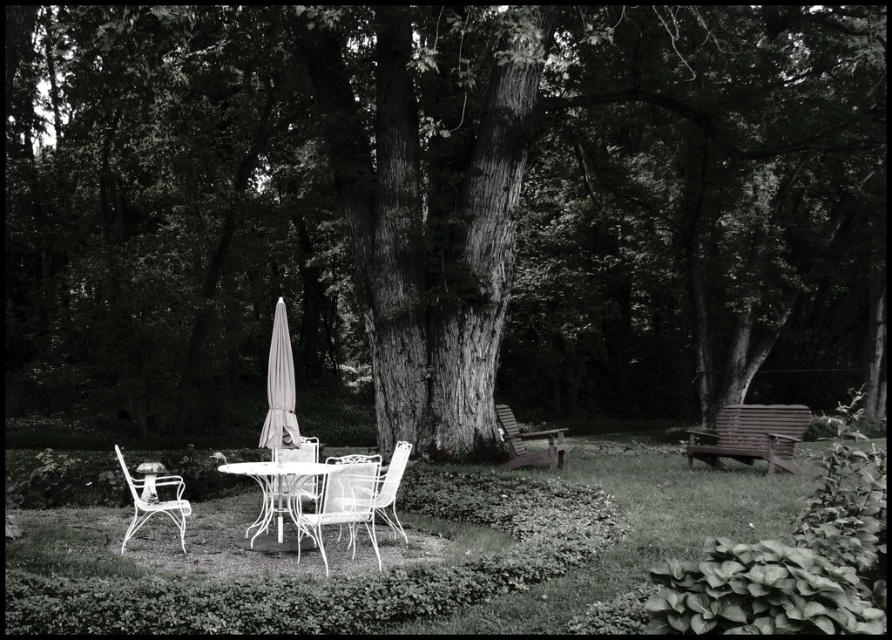
Question: In this image, where is white wrought iron table at center located relative to light gray fabric umbrella at center?

Choices:
 (A) above
 (B) below

Answer: (B)

Question: Can you confirm if light gray fabric umbrella at center is positioned above white metal chair at lower left?

Choices:
 (A) no
 (B) yes

Answer: (B)

Question: Among these objects, which one is nearest to the camera?

Choices:
 (A) white metal chair at lower left
 (B) white wrought iron table at center

Answer: (B)

Question: Is white wrought iron chair at center above white metal chair at center?

Choices:
 (A) yes
 (B) no

Answer: (B)

Question: Which point is closer to the camera?

Choices:
 (A) rough bark tree at center
 (B) white metal chair at center
 (C) light gray fabric umbrella at center

Answer: (B)

Question: Which is farther from the wooden slatted chair at center?

Choices:
 (A) light gray fabric umbrella at center
 (B) white wire chair at center

Answer: (A)